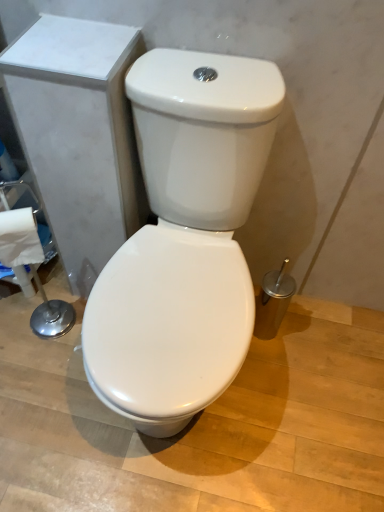
The width and height of the screenshot is (384, 512). What do you see at coordinates (184, 239) in the screenshot?
I see `white glossy toilet at center` at bounding box center [184, 239].

Measure the distance between point [207,96] and camera.

The depth of point [207,96] is 32.01 inches.

Locate an element on the screen. This screenshot has width=384, height=512. white glossy toilet at center is located at coordinates (184, 239).

What do you see at coordinates (19, 238) in the screenshot? I see `white paper towel at lower left` at bounding box center [19, 238].

At what (x,y) coordinates should I click in order to perform the action: click on white paper towel at lower left. Please return your answer as a coordinate pair (x, y). The image size is (384, 512). Looking at the image, I should click on (19, 238).

You are a GUI agent. You are given a task and a screenshot of the screen. Output one action in this format:
    pyautogui.click(x=<x>, y=<y>)
    Task: Click on the white glossy toilet at center
    The width and height of the screenshot is (384, 512).
    Given the screenshot: What is the action you would take?
    pyautogui.click(x=184, y=239)

Considering the positions of objects white paper towel at lower left and white glossy toilet at center in the image provided, who is more to the left, white paper towel at lower left or white glossy toilet at center?

white paper towel at lower left is more to the left.

Is white paper towel at lower left closer to camera compared to white glossy toilet at center?

That is False.

Considering the points (1, 230) and (214, 367), which point is behind, point (1, 230) or point (214, 367)?

Point (1, 230)

From the image's perspective, is white paper towel at lower left located above white glossy toilet at center?

Yes, from the image's perspective, white paper towel at lower left is over white glossy toilet at center.

From a real-world perspective, is white paper towel at lower left positioned above or below white glossy toilet at center?

Clearly, from a real-world perspective, white paper towel at lower left is above white glossy toilet at center.

Which object is thinner, white paper towel at lower left or white glossy toilet at center?

Thinner between the two is white paper towel at lower left.

Can you confirm if white paper towel at lower left is taller than white glossy toilet at center?

In fact, white paper towel at lower left may be shorter than white glossy toilet at center.

Considering the sizes of objects white paper towel at lower left and white glossy toilet at center in the image provided, who is smaller, white paper towel at lower left or white glossy toilet at center?

white paper towel at lower left.

Which is correct: white paper towel at lower left is inside white glossy toilet at center, or outside of it?

white paper towel at lower left is not inside white glossy toilet at center, it's outside.

Is white paper towel at lower left touching white glossy toilet at center?

No, white paper towel at lower left is not making contact with white glossy toilet at center.

Is white paper towel at lower left oriented away from white glossy toilet at center?

That's not correct — white paper towel at lower left is not looking away from white glossy toilet at center.

How many degrees apart are the facing directions of white paper towel at lower left and white glossy toilet at center?

The angular difference between white paper towel at lower left and white glossy toilet at center is 25.4 degrees.

Measure the distance between white paper towel at lower left and white glossy toilet at center.

14.85 inches.

This screenshot has width=384, height=512. I want to click on toilet below the white paper towel at lower left (from a real-world perspective), so click(x=184, y=239).

Which is more to the right, white glossy toilet at center or white paper towel at lower left?

white glossy toilet at center is more to the right.

In the image, is white glossy toilet at center positioned in front of or behind white paper towel at lower left?

Clearly, white glossy toilet at center is in front of white paper towel at lower left.

Considering the points (159, 346) and (27, 233), which point is in front, point (159, 346) or point (27, 233)?

Point (159, 346)

From the image's perspective, which one is positioned lower, white glossy toilet at center or white paper towel at lower left?

white glossy toilet at center is shown below in the image.

From a real-world perspective, who is located lower, white glossy toilet at center or white paper towel at lower left?

In real-world perspective, white glossy toilet at center is lower.

Considering the sizes of objects white glossy toilet at center and white paper towel at lower left in the image provided, who is wider, white glossy toilet at center or white paper towel at lower left?

white glossy toilet at center.

Is white glossy toilet at center shorter than white paper towel at lower left?

In fact, white glossy toilet at center may be taller than white paper towel at lower left.

Does white glossy toilet at center have a smaller size compared to white paper towel at lower left?

Incorrect, white glossy toilet at center is not smaller in size than white paper towel at lower left.

Would you say white paper towel at lower left is part of white glossy toilet at center's contents?

Actually, white paper towel at lower left is outside white glossy toilet at center.

Is white glossy toilet at center next to white paper towel at lower left?

No, white glossy toilet at center is not in contact with white paper towel at lower left.

Is white paper towel at lower left at the back of white glossy toilet at center?

No, white glossy toilet at center is not facing away from white paper towel at lower left.

How many degrees apart are the facing directions of white glossy toilet at center and white paper towel at lower left?

There is a 25.4-degree angle between the facing directions of white glossy toilet at center and white paper towel at lower left.

The image size is (384, 512). Find the location of `toilet paper above the white glossy toilet at center (from a real-world perspective)`. toilet paper above the white glossy toilet at center (from a real-world perspective) is located at coordinates (19, 238).

Locate an element on the screen. toilet paper above the white glossy toilet at center (from a real-world perspective) is located at coordinates (19, 238).

The width and height of the screenshot is (384, 512). In order to click on toilet in front of the white paper towel at lower left in this screenshot , I will do `click(184, 239)`.